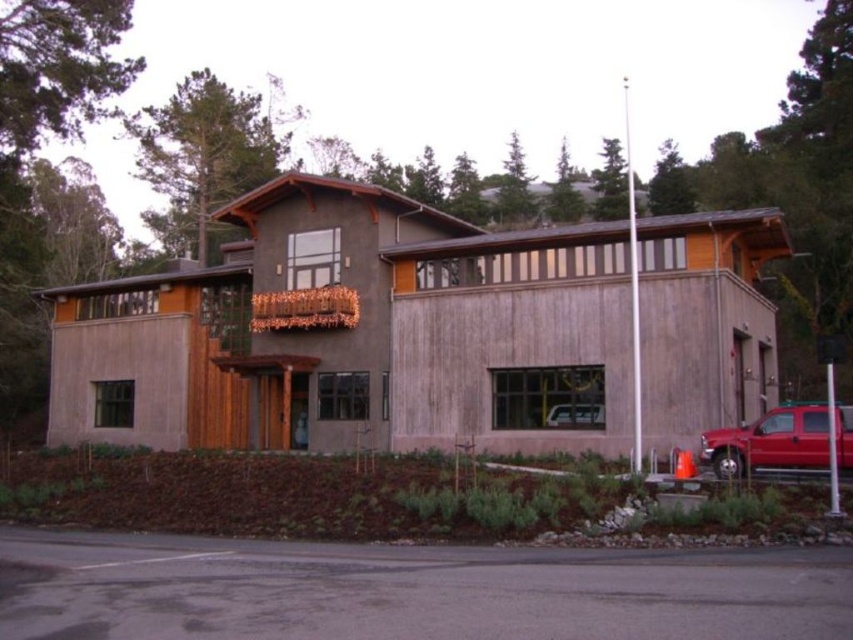
From the picture: You are standing in front of the building and want to walk from the brown mulch at lower left to the matte red truck at lower right. Which direction should you move relative to the building?

You should move to the right relative to the building because the brown mulch at lower left is positioned on the left side of the matte red truck at lower right.

You are standing at the entrance of the building and want to place a decorative pot. The pot must be placed exactly at the coordinates given for the brown mulch at lower left. What are the coordinates where you should place the pot?

The coordinates for the brown mulch at lower left are [296,496], so you should place the decorative pot at those coordinates.